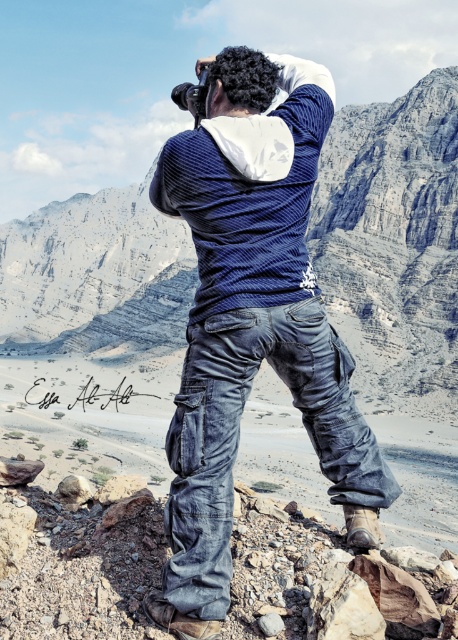
Question: From the image, what is the correct spatial relationship of denim pants at center in relation to rugged stone mountain at center?

Choices:
 (A) above
 (B) below

Answer: (B)

Question: Among these points, which one is nearest to the camera?

Choices:
 (A) (268, 118)
 (B) (103, 339)

Answer: (A)

Question: Which point appears farthest from the camera in this image?

Choices:
 (A) (195, 220)
 (B) (163, 317)

Answer: (B)

Question: Can you confirm if denim pants at center is wider than rugged stone mountain at center?

Choices:
 (A) yes
 (B) no

Answer: (B)

Question: Is denim pants at center in front of rugged stone mountain at center?

Choices:
 (A) no
 (B) yes

Answer: (B)

Question: Which object is farther from the camera taking this photo?

Choices:
 (A) denim pants at center
 (B) rugged stone mountain at center

Answer: (B)